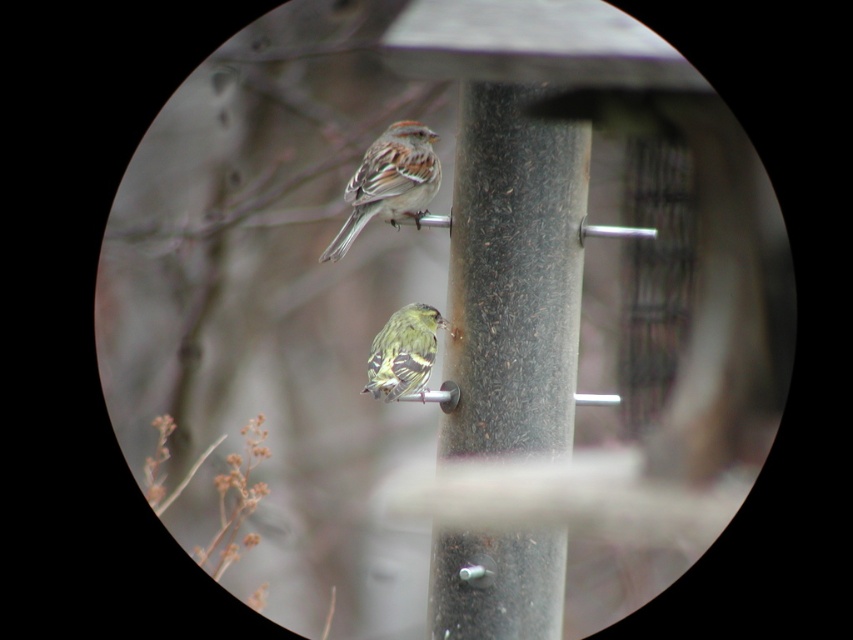
Does brown speckled feathers at upper center appear on the left side of yellow-green speckled sparrow at center?

Correct, you'll find brown speckled feathers at upper center to the left of yellow-green speckled sparrow at center.

Is point (368, 172) more distant than point (421, 371)?

Yes, point (368, 172) is behind point (421, 371).

Locate an element on the screen. The height and width of the screenshot is (640, 853). brown speckled feathers at upper center is located at coordinates (389, 182).